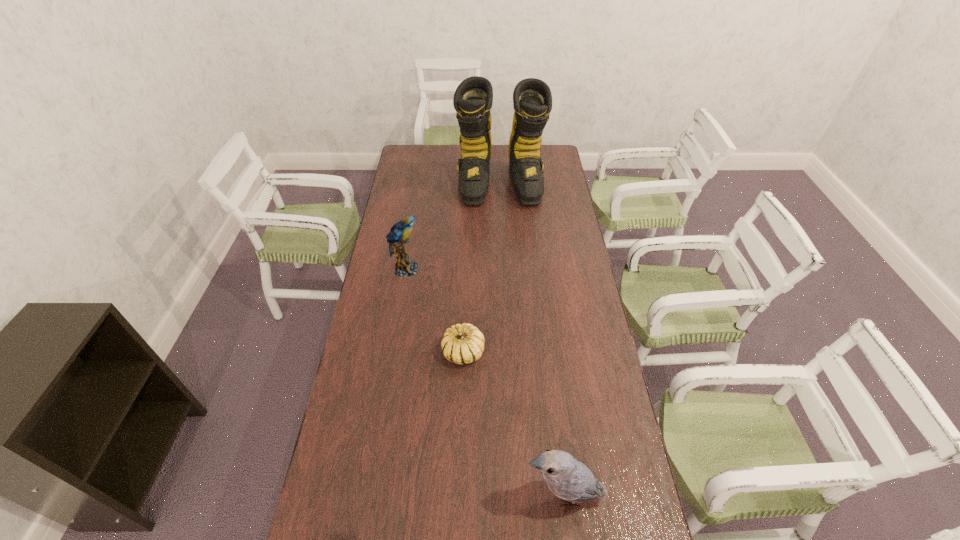
In the image, there is a desktop. At what (x,y) coordinates should I click in order to perform the action: click on free space at the right edge. Please return your answer as a coordinate pair (x, y). The height and width of the screenshot is (540, 960). Looking at the image, I should click on (540, 227).

Locate an element on the screen. vacant region between the second farthest object and the tallest object is located at coordinates (453, 227).

Locate an element on the screen. The image size is (960, 540). free space between the left parrot and the tallest object is located at coordinates (453, 227).

You are a GUI agent. You are given a task and a screenshot of the screen. Output one action in this format:
    pyautogui.click(x=<x>, y=<y>)
    Task: Click on the vacant region between the left parrot and the right parrot
    The height and width of the screenshot is (540, 960).
    Given the screenshot: What is the action you would take?
    pyautogui.click(x=485, y=383)

The width and height of the screenshot is (960, 540). Identify the location of vacant area between the leftmost object and the ski boots. (453, 227).

In order to click on vacant space in between the third farthest object and the nearer parrot in this screenshot , I will do `click(514, 424)`.

Identify the location of vacant space in between the tallest object and the shortest object. The width and height of the screenshot is (960, 540). (482, 268).

The width and height of the screenshot is (960, 540). In order to click on the closest object to the nearer parrot in this screenshot , I will do `click(464, 343)`.

Point out which object is positioned as the second nearest to the second nearest object. Please provide its 2D coordinates. Your answer should be formatted as a tuple, i.e. [(x, y)], where the tuple contains the x and y coordinates of a point satisfying the conditions above.

[(567, 478)]

Where is `free location that satisfies the following two spatial constraints: 1. on the face of the shortest object; 2. on the left side of the left parrot`? This screenshot has width=960, height=540. free location that satisfies the following two spatial constraints: 1. on the face of the shortest object; 2. on the left side of the left parrot is located at coordinates (392, 353).